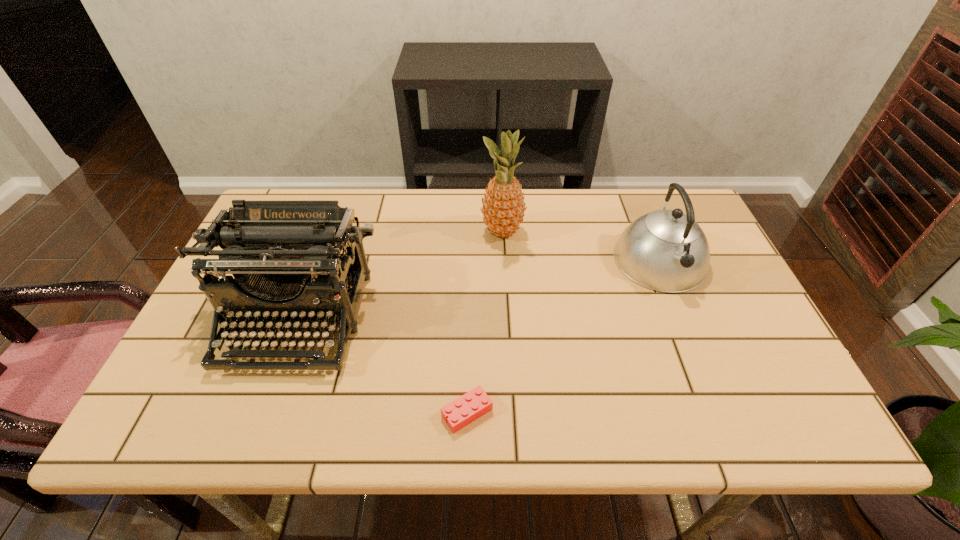
Find the location of a particular element. The height and width of the screenshot is (540, 960). kettle present at the far edge is located at coordinates (665, 250).

In order to click on object present at the near edge in this screenshot , I will do `click(467, 408)`.

You are a GUI agent. You are given a task and a screenshot of the screen. Output one action in this format:
    pyautogui.click(x=<x>, y=<y>)
    Task: Click on the object that is at the left edge
    This screenshot has width=960, height=540.
    Given the screenshot: What is the action you would take?
    pyautogui.click(x=283, y=255)

Find the location of `object located in the right edge section of the desktop`. object located in the right edge section of the desktop is located at coordinates (665, 250).

Identify the location of object positioned at the far right corner. Image resolution: width=960 pixels, height=540 pixels. (665, 250).

In the image, there is a desktop. Where is `vacant space at the far edge`? vacant space at the far edge is located at coordinates (469, 225).

Where is `blank space at the right edge`? blank space at the right edge is located at coordinates (693, 306).

In the image, there is a desktop. Identify the location of vacant space at the far right corner. The image size is (960, 540). (670, 201).

Where is `free space between the kettle and the pineapple`? The height and width of the screenshot is (540, 960). free space between the kettle and the pineapple is located at coordinates (581, 247).

Find the location of a particular element. The width and height of the screenshot is (960, 540). free space between the leftmost object and the Lego is located at coordinates (382, 366).